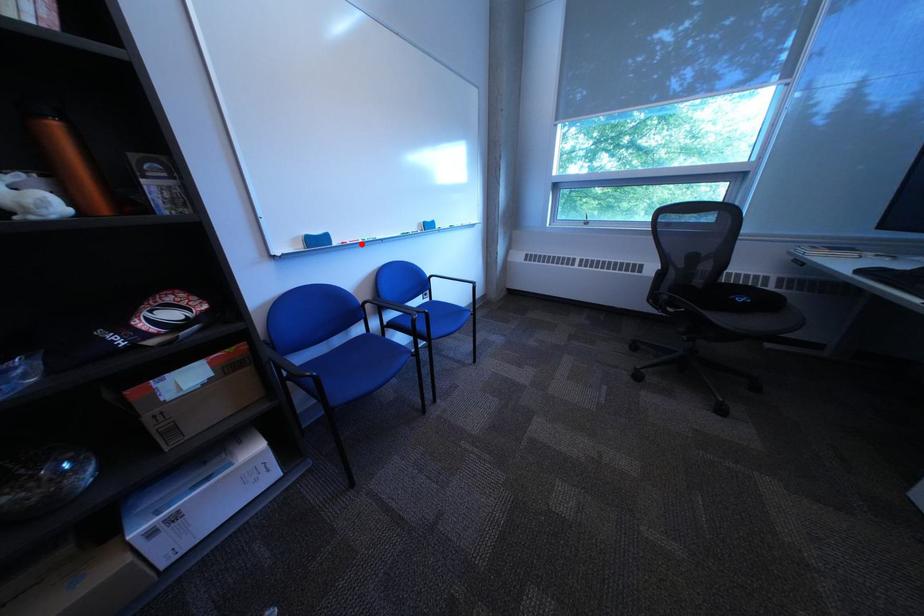
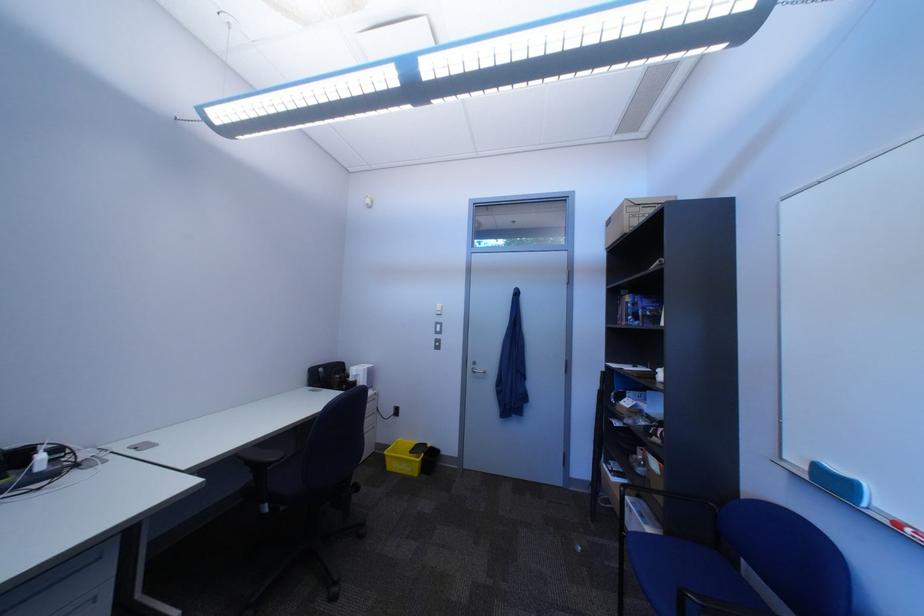
Question: I am providing you with two images of the same scene from different viewpoints. Image1 has a red point marked. In image2, the corresponding 3D location appears at what relative position? Reply with the corresponding letter.

Choices:
 (A) Closer
 (B) Farther

Answer: (B)